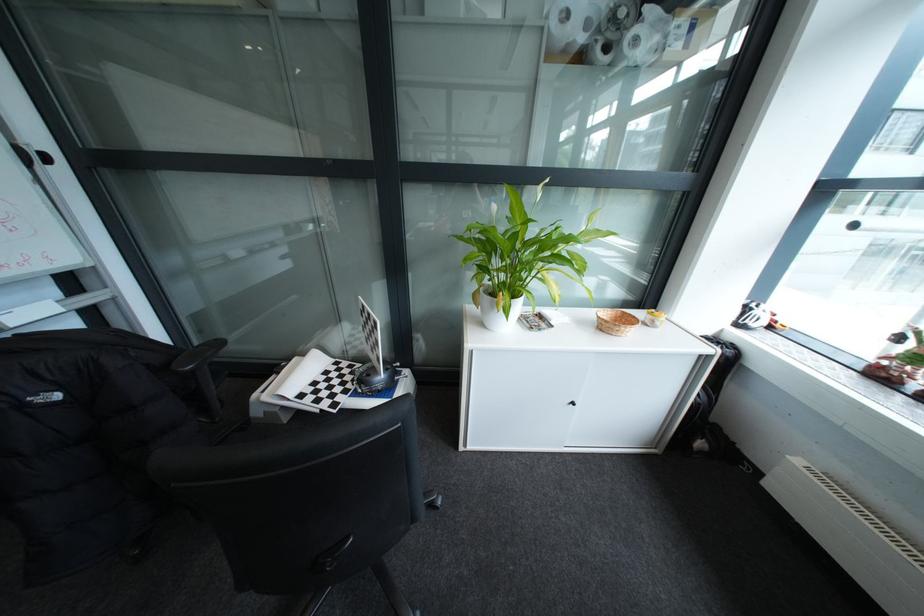
This screenshot has height=616, width=924. Find the location of `white plant pot`. white plant pot is located at coordinates tap(496, 310).